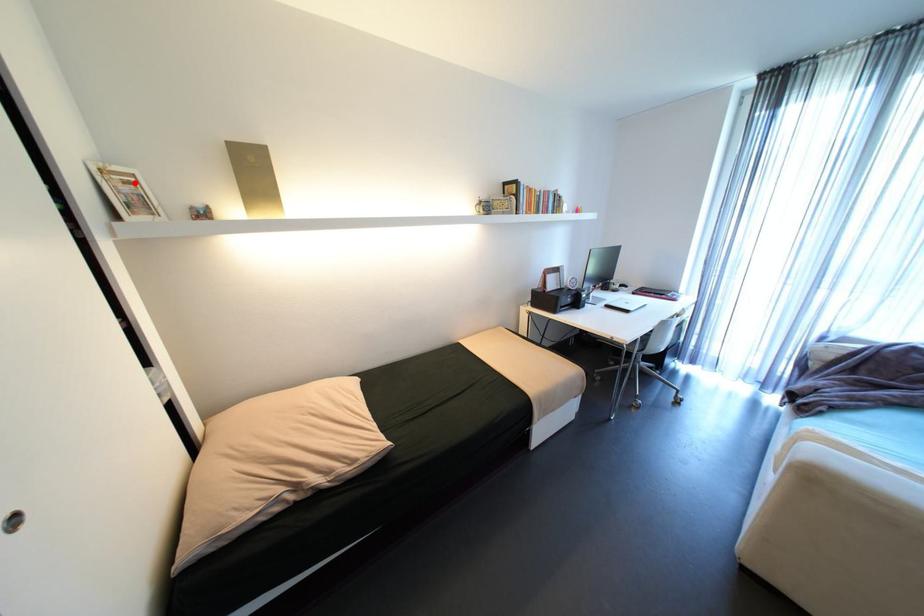
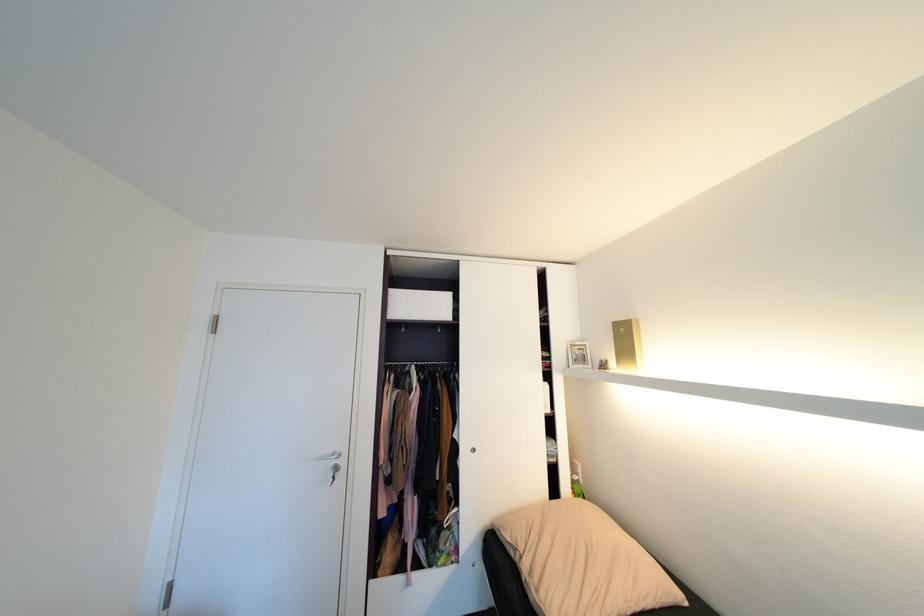
Where in the second image is the point corresponding to the highlighted location from the first image?

(587, 350)